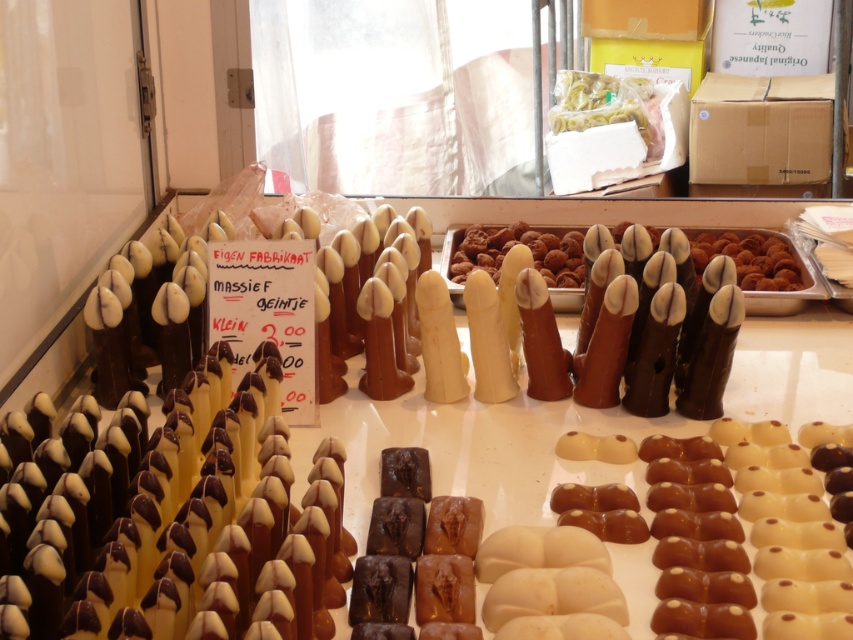
Question: Can you confirm if brown chocolate finger at center is wider than yellow matte pasta at center?

Choices:
 (A) no
 (B) yes

Answer: (B)

Question: Does brown chocolate finger at center have a smaller size compared to yellow matte pasta at center?

Choices:
 (A) yes
 (B) no

Answer: (B)

Question: Is brown chocolate finger at center to the left of yellow matte pasta at center from the viewer's perspective?

Choices:
 (A) yes
 (B) no

Answer: (A)

Question: Which of the following is the farthest from the observer?

Choices:
 (A) (643, 132)
 (B) (582, 259)

Answer: (A)

Question: Among these points, which one is farthest from the camera?

Choices:
 (A) (660, 140)
 (B) (537, 253)

Answer: (A)